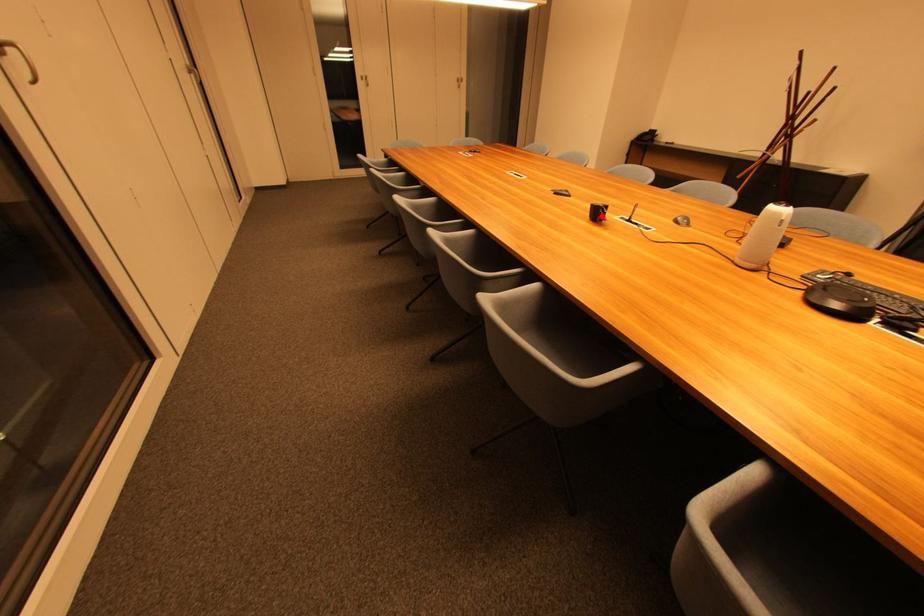
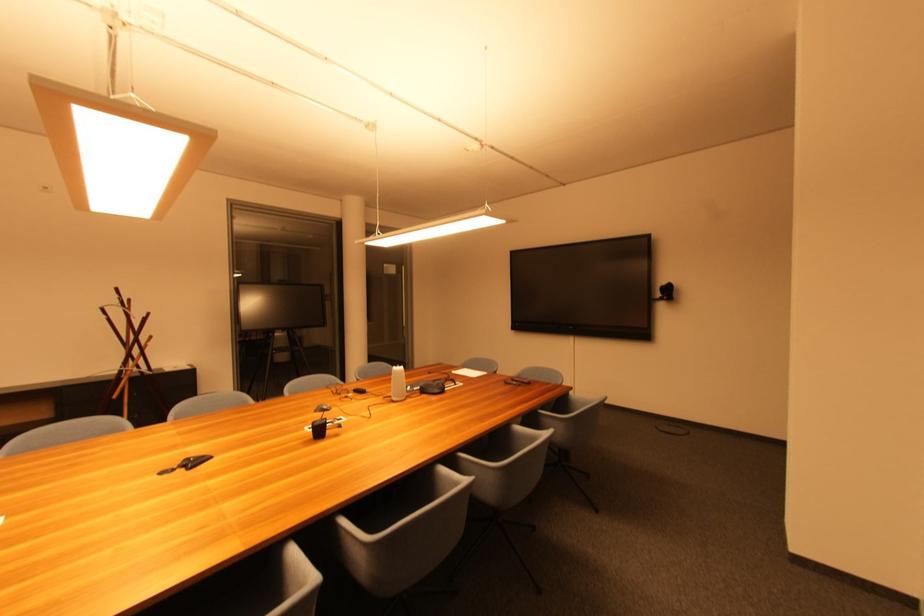
Find the pixel in the second image that matches the highlighted location in the first image.

(324, 432)